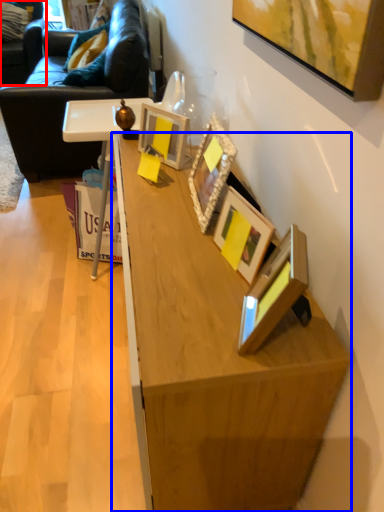
Question: Which object is further to the camera taking this photo, swivel chair (highlighted by a red box) or desk (highlighted by a blue box)?

Choices:
 (A) swivel chair
 (B) desk

Answer: (A)